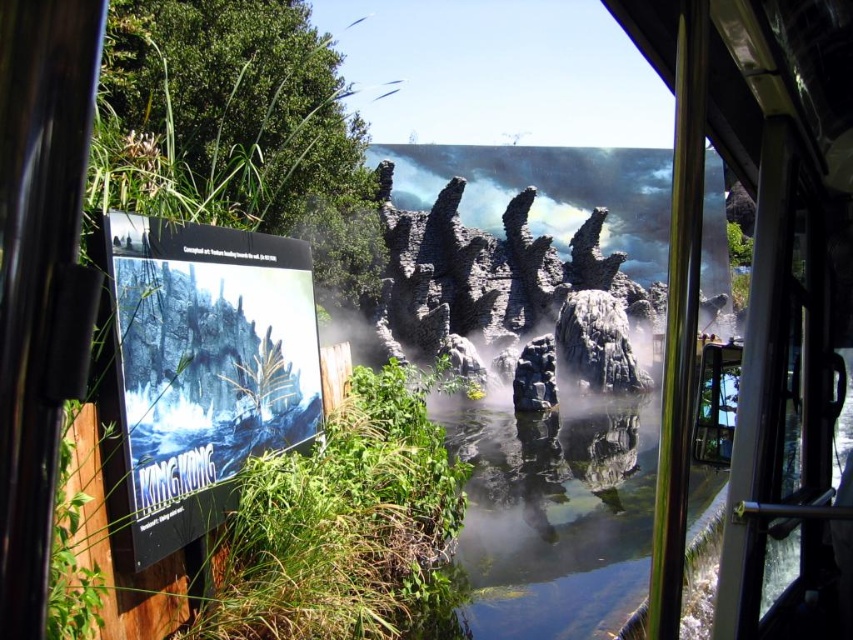
Question: Estimate the real-world distances between objects in this image. Which object is closer to the rugged stone rock formation at center?

Choices:
 (A) green leafy plant at center
 (B) clear water at center

Answer: (B)

Question: Which of the following is the farthest from the observer?

Choices:
 (A) (309, 451)
 (B) (463, 307)
 (C) (543, 420)

Answer: (B)

Question: Can you confirm if green leafy plant at center is wider than rugged stone rock formation at center?

Choices:
 (A) no
 (B) yes

Answer: (A)

Question: Considering the relative positions of clear water at center and rugged stone rock formation at center in the image provided, where is clear water at center located with respect to rugged stone rock formation at center?

Choices:
 (A) above
 (B) below

Answer: (B)

Question: Is clear water at center above rugged stone rock formation at center?

Choices:
 (A) no
 (B) yes

Answer: (A)

Question: Among these points, which one is farthest from the camera?

Choices:
 (A) (570, 244)
 (B) (277, 616)

Answer: (A)